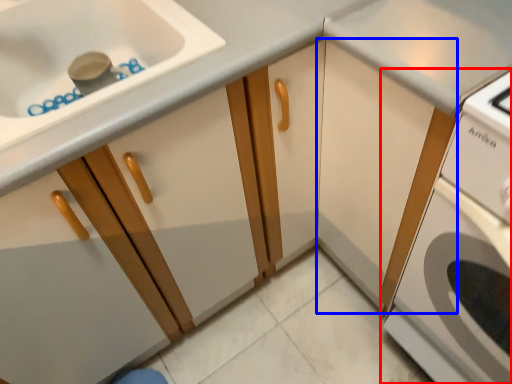
Question: Among these objects, which one is nearest to the camera, home appliance (highlighted by a red box) or cabinetry (highlighted by a blue box)?

Choices:
 (A) home appliance
 (B) cabinetry

Answer: (A)